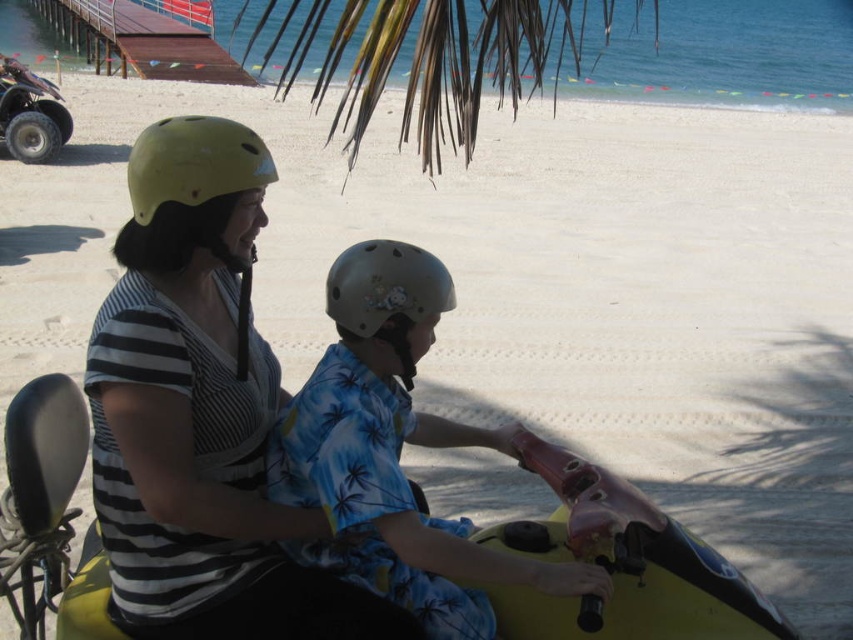
Question: Which is nearer to the yellow matte motorcycle at center?

Choices:
 (A) green leafy palm tree at upper center
 (B) blue floral shirt at center
 (C) yellow matte helmet at upper left
 (D) matte olive green helmet at center

Answer: (B)

Question: Is blue floral shirt at center to the right of yellow matte helmet at upper left from the viewer's perspective?

Choices:
 (A) yes
 (B) no

Answer: (A)

Question: Can you confirm if green leafy palm tree at upper center is positioned to the right of yellow matte helmet at upper left?

Choices:
 (A) yes
 (B) no

Answer: (A)

Question: Which object is the closest to the blue floral shirt at center?

Choices:
 (A) yellow matte helmet at upper left
 (B) matte olive green helmet at center
 (C) yellow matte motorcycle at center

Answer: (B)

Question: Which point is farther to the camera?

Choices:
 (A) yellow matte helmet at upper left
 (B) matte olive green helmet at center
 (C) yellow matte motorcycle at center
 (D) green leafy palm tree at upper center

Answer: (D)

Question: Does yellow matte helmet at upper left have a larger size compared to matte olive green helmet at center?

Choices:
 (A) yes
 (B) no

Answer: (A)